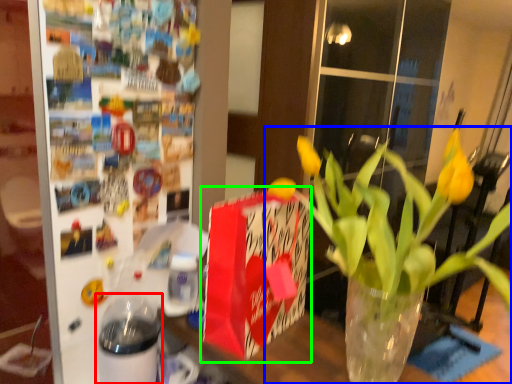
Question: Considering the real-world distances, which object is closest to glass jar (highlighted by a red box)? houseplant (highlighted by a blue box) or gift bag (highlighted by a green box).

Choices:
 (A) houseplant
 (B) gift bag

Answer: (B)